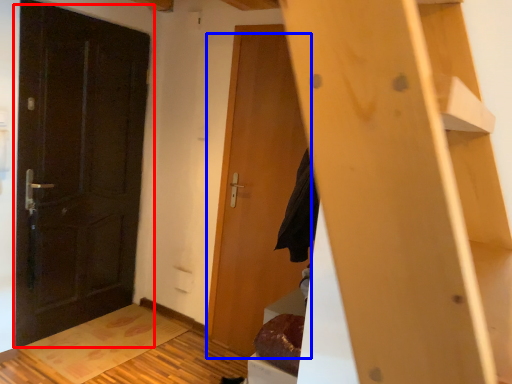
Question: Which of the following is the closest to the observer, door (highlighted by a red box) or door (highlighted by a blue box)?

Choices:
 (A) door
 (B) door

Answer: (A)